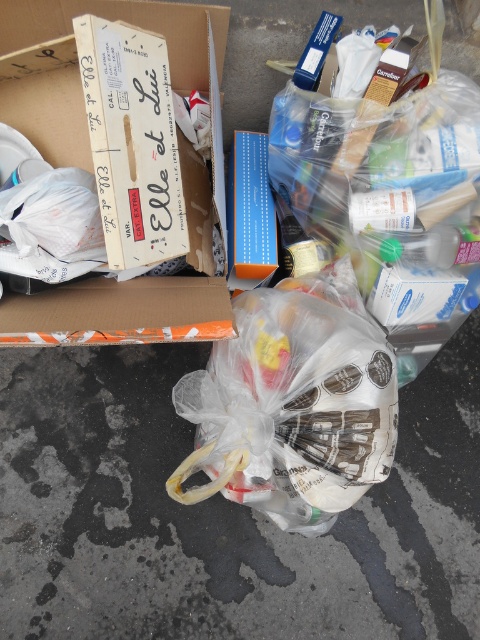
The height and width of the screenshot is (640, 480). What do you see at coordinates (294, 403) in the screenshot? I see `clear plastic bag at center` at bounding box center [294, 403].

Which is more to the right, clear plastic bag at center or white cardboard box at upper left?

clear plastic bag at center is more to the right.

The width and height of the screenshot is (480, 640). What do you see at coordinates (294, 403) in the screenshot?
I see `clear plastic bag at center` at bounding box center [294, 403].

Where is `clear plastic bag at center`? clear plastic bag at center is located at coordinates (294, 403).